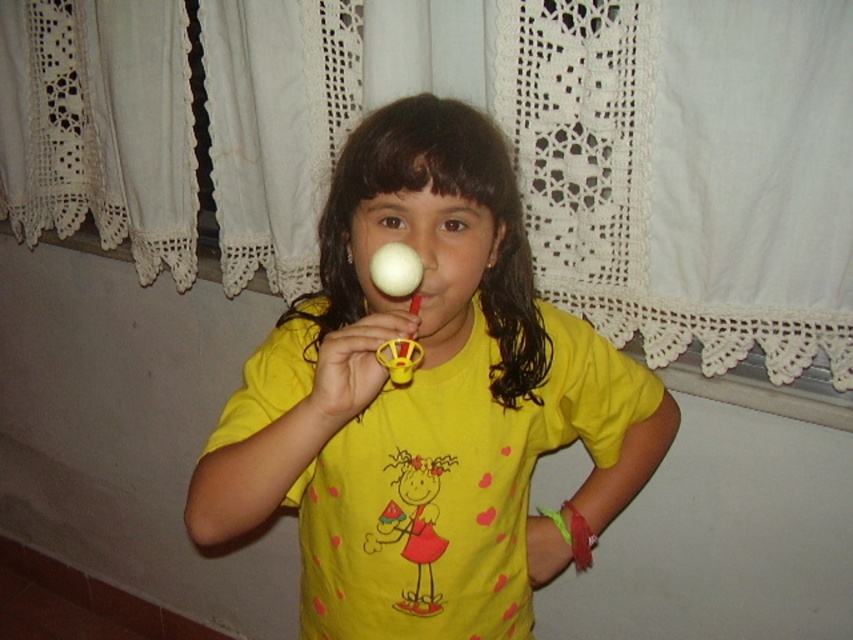
Is yellow matte shirt at center shorter than matte plastic rattle at center?

Incorrect, yellow matte shirt at center's height does not fall short of matte plastic rattle at center's.

This screenshot has height=640, width=853. In order to click on yellow matte shirt at center in this screenshot , I will do `click(427, 403)`.

Who is more forward, (x=590, y=499) or (x=401, y=385)?

Point (x=401, y=385) is in front.

Locate an element on the screen. yellow matte shirt at center is located at coordinates tap(427, 403).